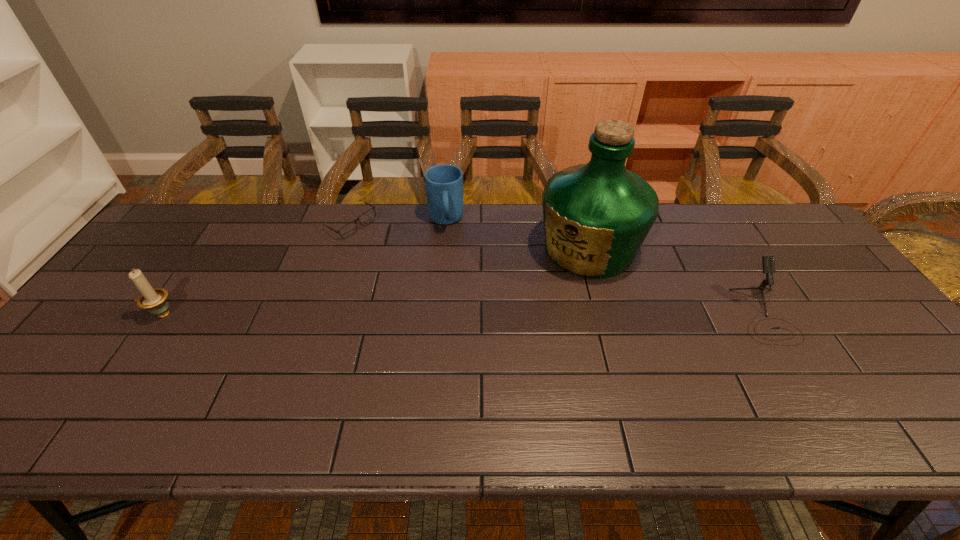
At what (x,y) coordinates should I click in order to perform the action: click on vacant area situated on the stand of the second shortest object. Please return your answer as a coordinate pair (x, y). Looking at the image, I should click on (800, 374).

You are a GUI agent. You are given a task and a screenshot of the screen. Output one action in this format:
    pyautogui.click(x=<x>, y=<y>)
    Task: Click on the vacant space situated on the side of the third object from left to right with the handle
    Image resolution: width=960 pixels, height=540 pixels.
    Given the screenshot: What is the action you would take?
    pyautogui.click(x=448, y=267)

At what (x,y) coordinates should I click in order to perform the action: click on vacant space situated 0.160m on the side of the third object from left to right with the handle. Please return your answer as a coordinate pair (x, y). This screenshot has height=540, width=960. Looking at the image, I should click on (448, 272).

Find the location of a particular element. The image size is (960, 540). vacant space located 0.210m on the side of the third object from left to right with the handle is located at coordinates (449, 284).

Identify the location of vacant space located on the label side of the second object from right to left. (512, 318).

Where is `vacant area situated 0.150m on the label side of the second object from right to left`? vacant area situated 0.150m on the label side of the second object from right to left is located at coordinates (526, 305).

Identify the location of vacant point located on the label side of the second object from right to left. The height and width of the screenshot is (540, 960). (494, 334).

The image size is (960, 540). I want to click on vacant area situated with the lenses facing outward on the spectacles, so click(x=366, y=280).

At what (x,y) coordinates should I click in order to perform the action: click on vacant space located 0.180m with the lenses facing outward on the spectacles. Please return your answer as a coordinate pair (x, y). The image size is (960, 540). Looking at the image, I should click on (365, 278).

In order to click on vacant position located 0.150m with the lenses facing outward on the spectacles in this screenshot , I will do `click(363, 271)`.